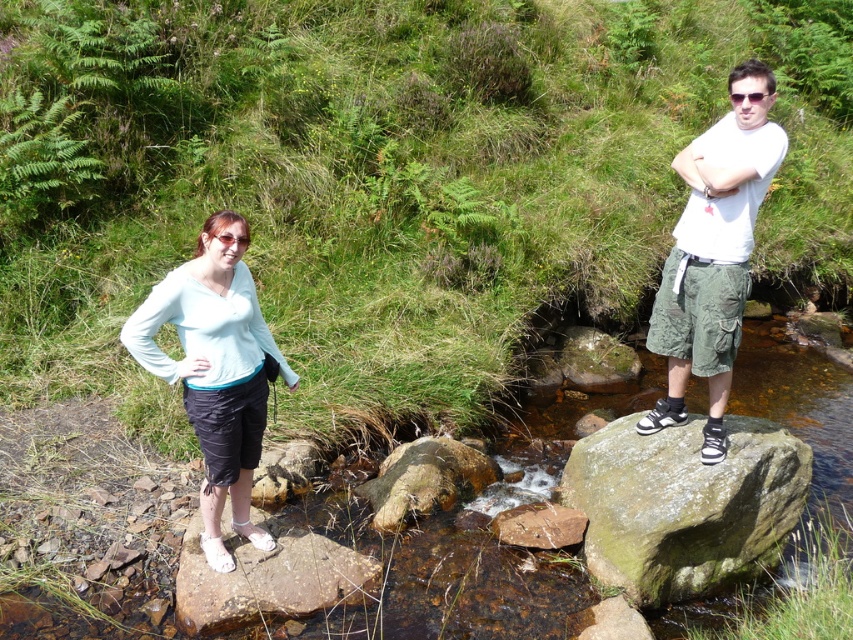
You are a photographer planning to take a picture of the green mossy rock at right and the white matte skirt at left. Since you want both subjects to appear equally prominent in the photo, which object should you move closer to the camera?

Since the green mossy rock at right is larger than the white matte skirt at left, you should move the green mossy rock at right closer to the camera to balance their prominence in the photo.

You are trying to decide where to place a small potted plant. The green mossy rock at right and the white matte skirt at left are both potential spots. Based on their heights, which location would allow the plant to be more visible?

The white matte skirt at left is taller than the green mossy rock at right, so placing the plant on the white matte skirt at left would make it more visible.